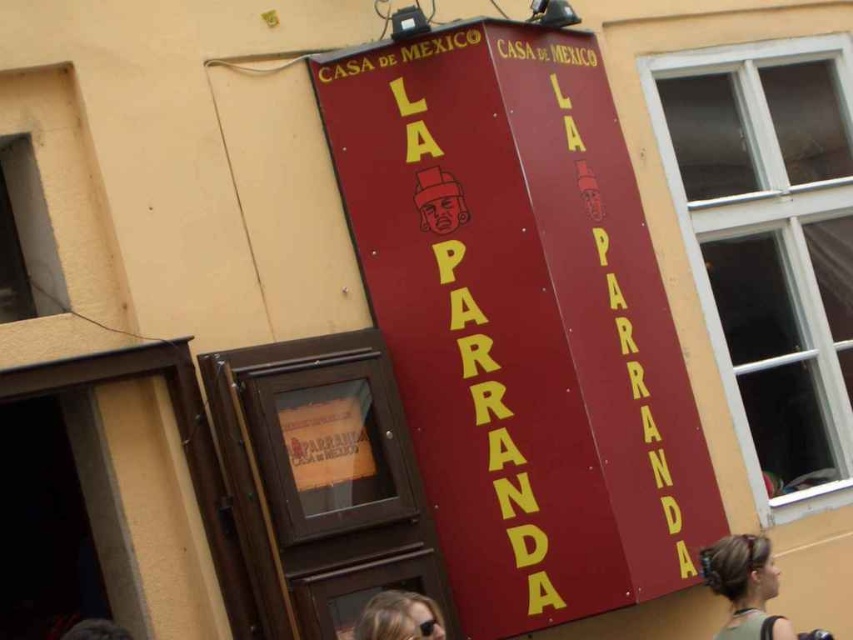
Is matte red sign at center in front of blonde hair at center?

No.

Can you confirm if matte red sign at center is positioned to the right of blonde hair at center?

In fact, matte red sign at center is to the left of blonde hair at center.

Is point (335, 109) positioned in front of point (723, 552)?

That is False.

Where is `matte red sign at center`? matte red sign at center is located at coordinates (521, 320).

Can you confirm if blonde hair at center is thinner than blonde hair at lower center?

Correct, blonde hair at center's width is less than blonde hair at lower center's.

Does blonde hair at center appear under blonde hair at lower center?

Yes, blonde hair at center is below blonde hair at lower center.

Where is `blonde hair at center`? The height and width of the screenshot is (640, 853). blonde hair at center is located at coordinates (746, 586).

Does matte red sign at center have a larger size compared to blonde hair at lower center?

Correct, matte red sign at center is larger in size than blonde hair at lower center.

At what (x,y) coordinates should I click in order to perform the action: click on matte red sign at center. Please return your answer as a coordinate pair (x, y). Image resolution: width=853 pixels, height=640 pixels. Looking at the image, I should click on (521, 320).

Does point (415, 276) lie behind point (421, 605)?

Yes, it is.

The image size is (853, 640). Find the location of `matte red sign at center`. matte red sign at center is located at coordinates (521, 320).